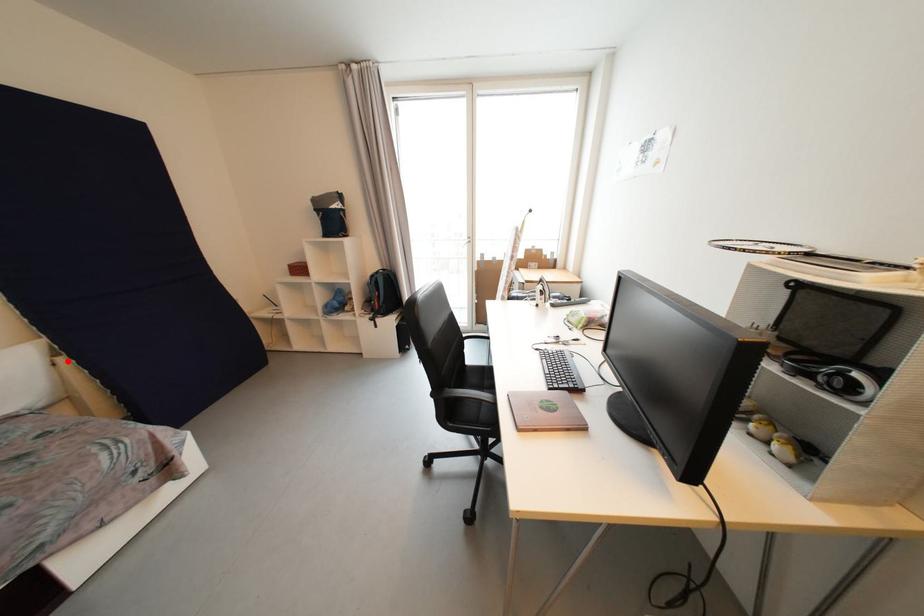
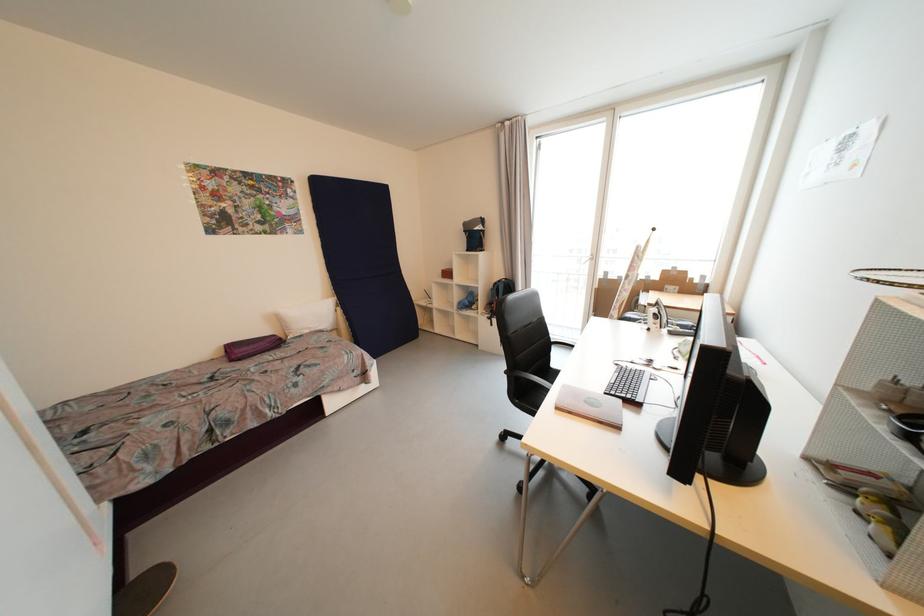
Find the pixel in the second image that matches the highlighted location in the first image.

(344, 310)